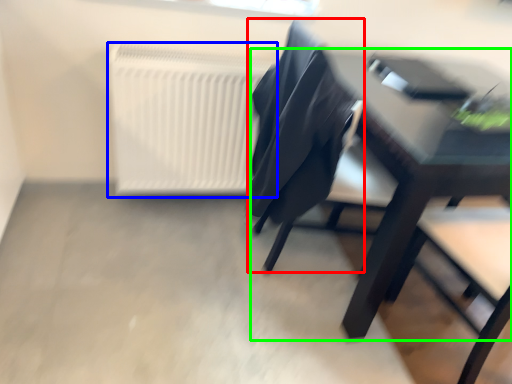
Question: Based on their relative distances, which object is nearer to chair (highlighted by a red box)? Choose from radiator (highlighted by a blue box) and table (highlighted by a green box).

Choices:
 (A) radiator
 (B) table

Answer: (B)